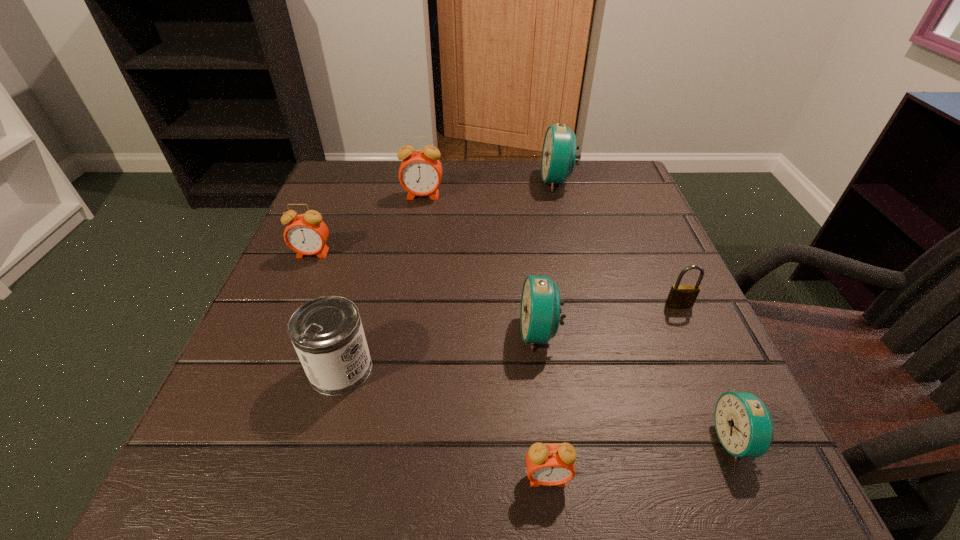
Locate an element on the screen. This screenshot has height=540, width=960. vacant point located between the leftmost pink alarm clock and the biggest pink alarm clock is located at coordinates (368, 225).

At what (x,y) coordinates should I click in order to perform the action: click on free area in between the can and the nearest pink alarm clock. Please return your answer as a coordinate pair (x, y). The height and width of the screenshot is (540, 960). Looking at the image, I should click on (444, 423).

At what (x,y) coordinates should I click in order to perform the action: click on vacant point located between the padlock and the leftmost alarm clock. Please return your answer as a coordinate pair (x, y). The height and width of the screenshot is (540, 960). Looking at the image, I should click on (495, 279).

Locate an element on the screen. vacant point located between the fifth alarm clock from left to right and the rightmost alarm clock is located at coordinates (646, 310).

Identify the location of free area in between the second alarm clock from right to left and the can. The height and width of the screenshot is (540, 960). (449, 275).

Identify the location of unoccupied area between the brass padlock and the smallest pink alarm clock. This screenshot has height=540, width=960. (613, 392).

Image resolution: width=960 pixels, height=540 pixels. Identify the location of vacant point located between the padlock and the nearest blue alarm clock. (707, 373).

Identify the location of free point between the smallest blue alarm clock and the biggest pink alarm clock. (579, 318).

Find the location of a particular element. object that is the fourth closest to the can is located at coordinates (420, 173).

Image resolution: width=960 pixels, height=540 pixels. Identify the location of object identified as the third closest to the second biggest blue alarm clock. (744, 426).